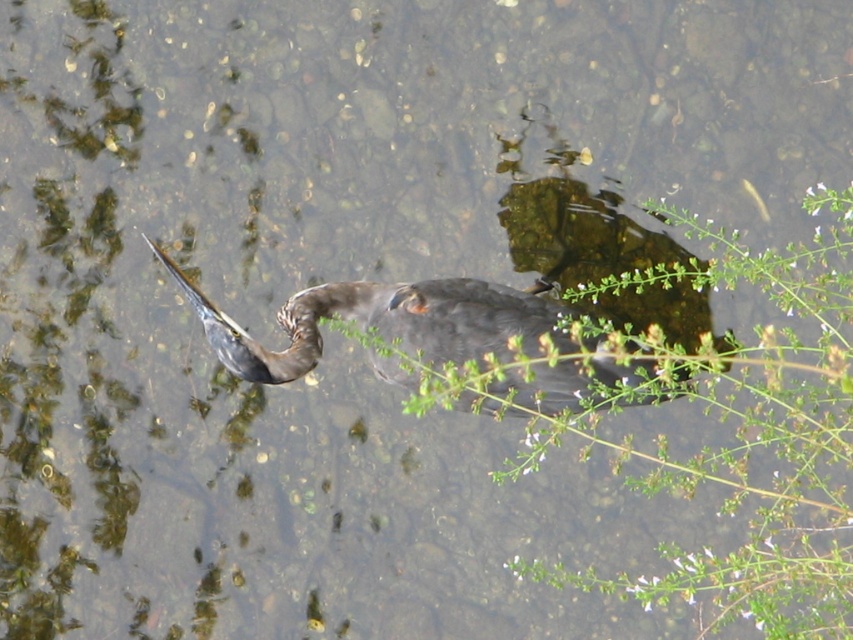
Looking at this image, between green leafy plant at center and dark brown feathers at center, which one has less height?

dark brown feathers at center

Which is below, green leafy plant at center or dark brown feathers at center?

dark brown feathers at center is lower down.

The height and width of the screenshot is (640, 853). What are the coordinates of `green leafy plant at center` in the screenshot? It's located at (737, 429).

At what (x,y) coordinates should I click in order to perform the action: click on green leafy plant at center. Please return your answer as a coordinate pair (x, y). Image resolution: width=853 pixels, height=640 pixels. Looking at the image, I should click on (737, 429).